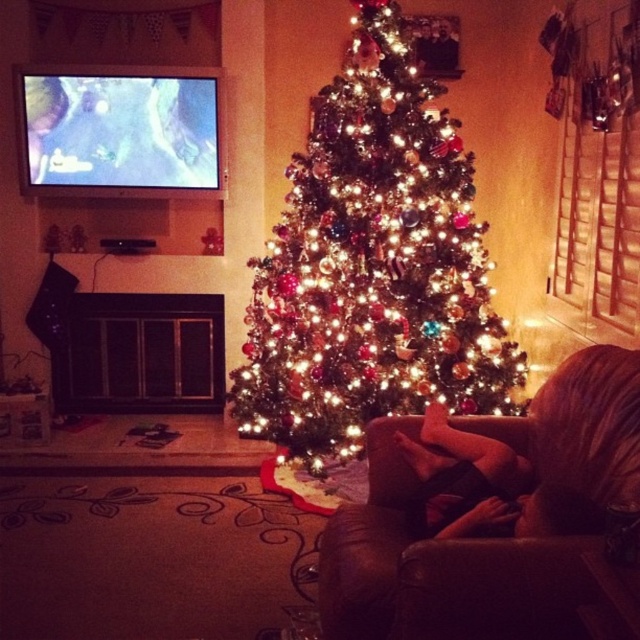
Question: Which point is farther from the camera taking this photo?

Choices:
 (A) [x=496, y=496]
 (B) [x=330, y=326]
 (C) [x=346, y=608]

Answer: (B)

Question: Which point appears farthest from the camera in this image?

Choices:
 (A) (403, 609)
 (B) (333, 314)

Answer: (B)

Question: Is brown leather couch at center bigger than black leather pants at lower center?

Choices:
 (A) yes
 (B) no

Answer: (A)

Question: Is brown leather couch at center in front of black leather pants at lower center?

Choices:
 (A) yes
 (B) no

Answer: (A)

Question: Based on their relative distances, which object is nearer to the black leather pants at lower center?

Choices:
 (A) brown leather couch at center
 (B) iridescent glass ornaments at center

Answer: (A)

Question: Does iridescent glass ornaments at center have a smaller size compared to black leather pants at lower center?

Choices:
 (A) yes
 (B) no

Answer: (B)